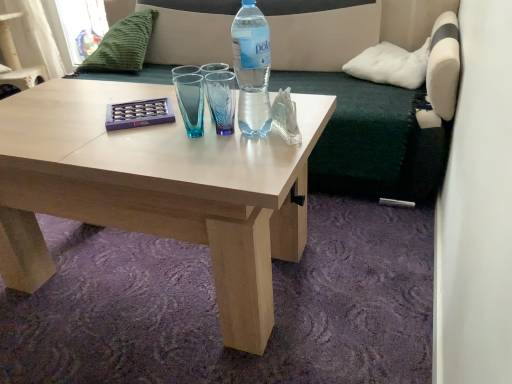
Question: Looking at the image, does dark green fabric couch at upper center seem bigger or smaller compared to white soft pillow at upper right, arranged as the first pillow when viewed from the front?

Choices:
 (A) big
 (B) small

Answer: (A)

Question: From a real-world perspective, is dark green fabric couch at upper center positioned above or below white soft pillow at upper right, the second pillow from the back?

Choices:
 (A) below
 (B) above

Answer: (A)

Question: Which of these objects is positioned closest to the dark green fabric couch at upper center?

Choices:
 (A) light wood coffee table at center
 (B) translucent plastic bottle at center
 (C) white soft pillow at upper right, arranged as the first pillow when viewed from the right
 (D) green knitted pillow at upper left, which appears as the 1th pillow when viewed from the back
 (E) white fabric armchair at upper left

Answer: (C)

Question: Which is nearer to the green knitted pillow at upper left, which appears as the 1th pillow when viewed from the left?

Choices:
 (A) white fabric armchair at upper left
 (B) light wood coffee table at center
 (C) white soft pillow at upper right, arranged as the first pillow when viewed from the right
 (D) translucent plastic bottle at center
 (E) dark green fabric couch at upper center

Answer: (E)